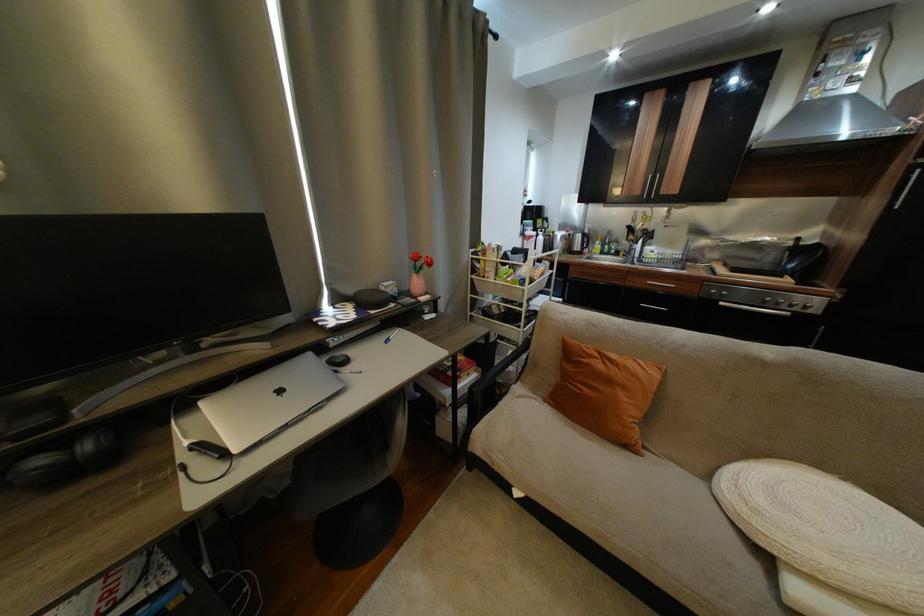
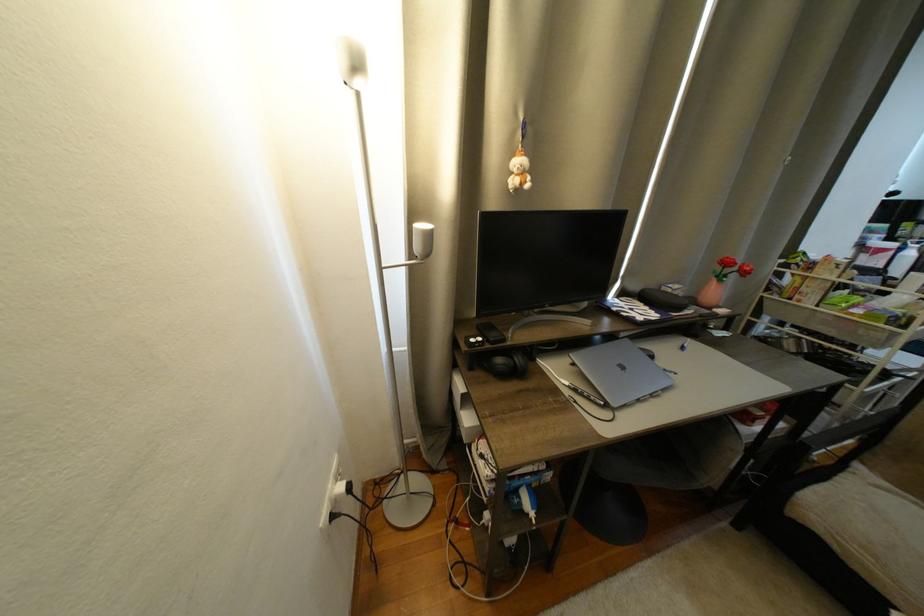
Find the pixel in the second image that matches point (244, 453) in the first image.

(621, 406)